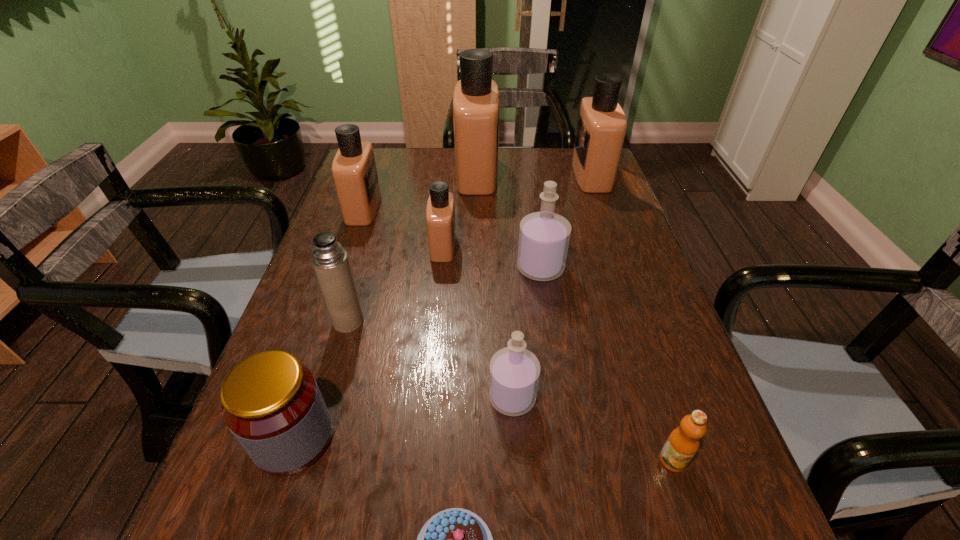
Find the location of a particular element. The height and width of the screenshot is (540, 960). blank space at the far edge of the desktop is located at coordinates coord(543,153).

Identify the location of blank space at the left edge. (364, 281).

This screenshot has width=960, height=540. I want to click on vacant space at the right edge of the desktop, so click(x=595, y=256).

This screenshot has width=960, height=540. Identify the location of vacant space at the far right corner of the desktop. (560, 169).

Find the location of a particular element. vacant region between the red jar and the orange juice is located at coordinates (483, 449).

I want to click on free area in between the thermos bottle and the nearer purple perfume, so click(430, 360).

Find the location of a particular element. The height and width of the screenshot is (540, 960). free space between the jar and the leftmost beige perfume is located at coordinates (328, 323).

Locate an element on the screen. The height and width of the screenshot is (540, 960). free point between the leftmost perfume and the tallest object is located at coordinates (420, 191).

Where is `free area in between the third biggest beige perfume and the nearest perfume`? This screenshot has height=540, width=960. free area in between the third biggest beige perfume and the nearest perfume is located at coordinates pyautogui.click(x=438, y=303).

The height and width of the screenshot is (540, 960). What are the coordinates of `empty location between the smaller purple perfume and the thermos bottle` in the screenshot? It's located at (430, 360).